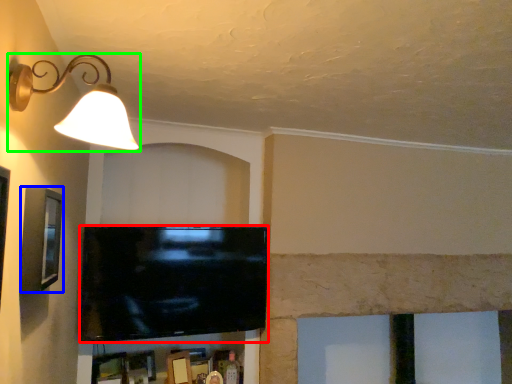
Question: Estimate the real-world distances between objects in this image. Which object is farther from television (highlighted by a red box), picture frame (highlighted by a blue box) or lamp (highlighted by a green box)?

Choices:
 (A) picture frame
 (B) lamp

Answer: (B)